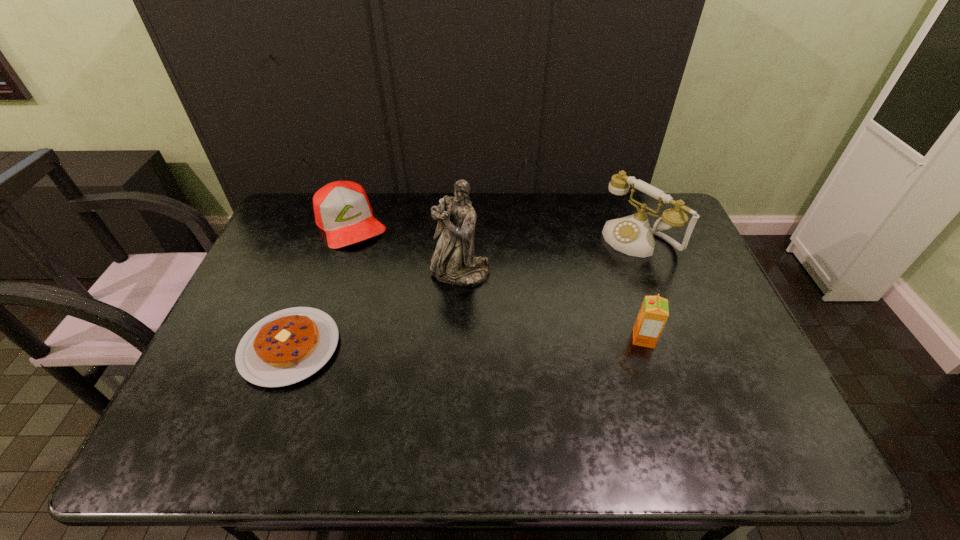
At what (x,y) coordinates should I click in order to perform the action: click on free space at the near left corner of the desktop. Please return your answer as a coordinate pair (x, y). Looking at the image, I should click on (228, 388).

Identify the location of empty space between the shortest object and the tallest object. The width and height of the screenshot is (960, 540). (375, 310).

I want to click on free space between the fourth shortest object and the third object from right to left, so coord(549,255).

The image size is (960, 540). What are the coordinates of `empty space between the telephone and the third shortest object` in the screenshot? It's located at (641, 289).

Locate an element on the screen. The image size is (960, 540). vacant area that lies between the second shortest object and the telephone is located at coordinates click(494, 231).

Where is `vacant point located between the second tallest object and the shortest object`? vacant point located between the second tallest object and the shortest object is located at coordinates (464, 293).

Image resolution: width=960 pixels, height=540 pixels. What are the coordinates of `free space that is in between the baseball cap and the pancake` in the screenshot? It's located at pos(320,285).

Locate an element on the screen. The height and width of the screenshot is (540, 960). vacant space that is in between the orange juice and the second tallest object is located at coordinates point(641,289).

Where is `blank region between the pancake and the telephone`? This screenshot has width=960, height=540. blank region between the pancake and the telephone is located at coordinates (464, 293).

Where is `vacant region between the orange juice and the second shortest object`? Image resolution: width=960 pixels, height=540 pixels. vacant region between the orange juice and the second shortest object is located at coordinates (x=497, y=281).